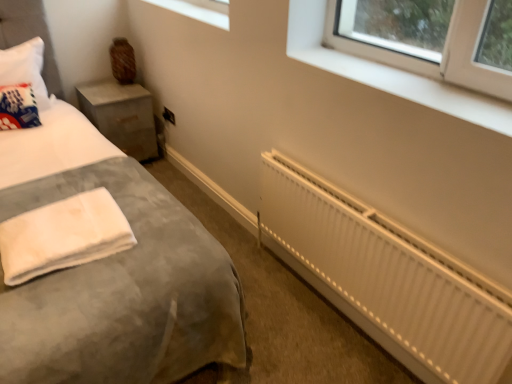
Question: Does velvet grey bed at lower left come behind white fabric throw pillow at left?

Choices:
 (A) no
 (B) yes

Answer: (A)

Question: Would you say velvet grey bed at lower left is outside white fabric throw pillow at left?

Choices:
 (A) yes
 (B) no

Answer: (A)

Question: Is velvet grey bed at lower left positioned far away from white fabric throw pillow at left?

Choices:
 (A) yes
 (B) no

Answer: (A)

Question: Considering the relative sizes of velvet grey bed at lower left and white fabric throw pillow at left in the image provided, is velvet grey bed at lower left smaller than white fabric throw pillow at left?

Choices:
 (A) no
 (B) yes

Answer: (A)

Question: From a real-world perspective, is velvet grey bed at lower left physically above white fabric throw pillow at left?

Choices:
 (A) no
 (B) yes

Answer: (B)

Question: From the image's perspective, is velvet grey bed at lower left located above white fabric throw pillow at left?

Choices:
 (A) yes
 (B) no

Answer: (B)

Question: From a real-world perspective, is white fluffy towel at lower left under white fabric throw pillow at left?

Choices:
 (A) no
 (B) yes

Answer: (B)

Question: Can you confirm if white fluffy towel at lower left is wider than white fabric throw pillow at left?

Choices:
 (A) yes
 (B) no

Answer: (A)

Question: Does white fluffy towel at lower left have a larger size compared to white fabric throw pillow at left?

Choices:
 (A) no
 (B) yes

Answer: (A)

Question: Are white fluffy towel at lower left and white fabric throw pillow at left far apart?

Choices:
 (A) yes
 (B) no

Answer: (A)

Question: Is white fluffy towel at lower left positioned before white fabric throw pillow at left?

Choices:
 (A) no
 (B) yes

Answer: (B)

Question: Is white fluffy towel at lower left behind white fabric throw pillow at left?

Choices:
 (A) no
 (B) yes

Answer: (A)

Question: Is velvet grey bed at lower left completely or partially inside white fluffy towel at lower left?

Choices:
 (A) no
 (B) yes

Answer: (A)